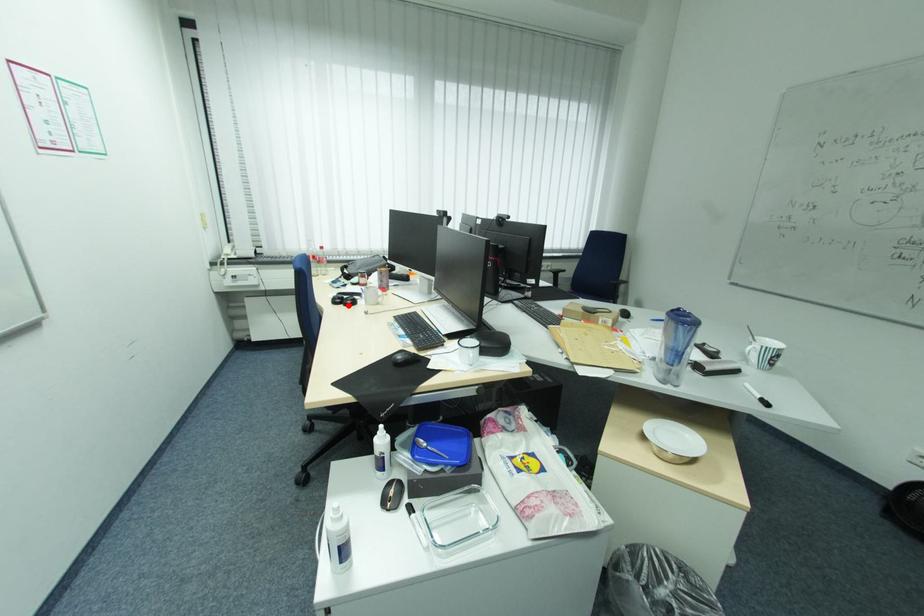
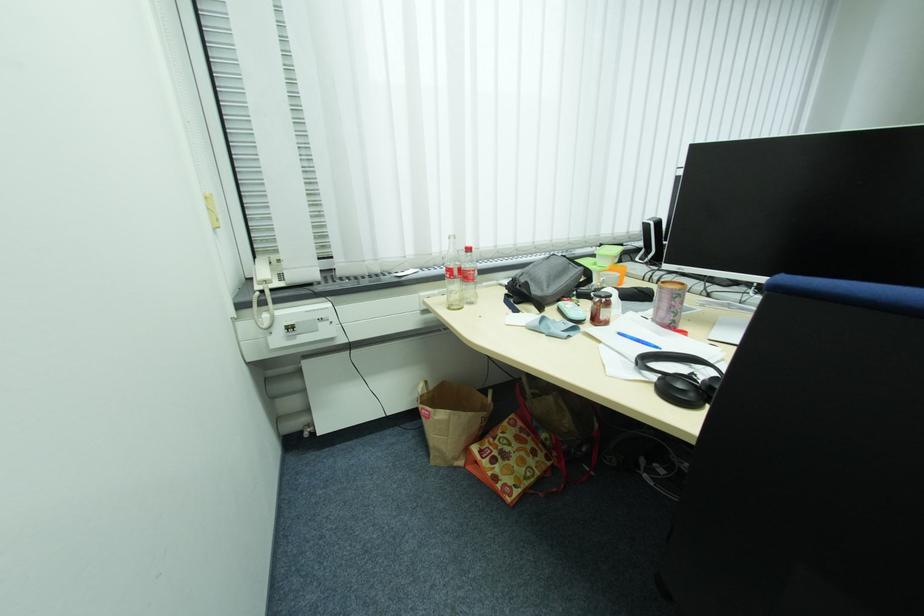
Question: I am providing you with two images of the same scene from different viewpoints. A red point is marked on the first image. Can you still see the location of the red point in image 2?

Choices:
 (A) Yes
 (B) No

Answer: (B)